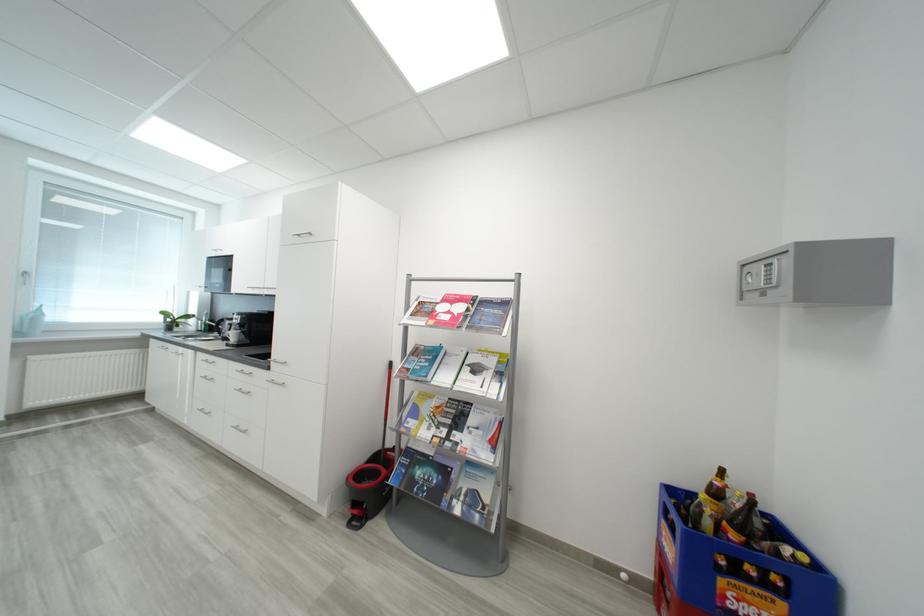
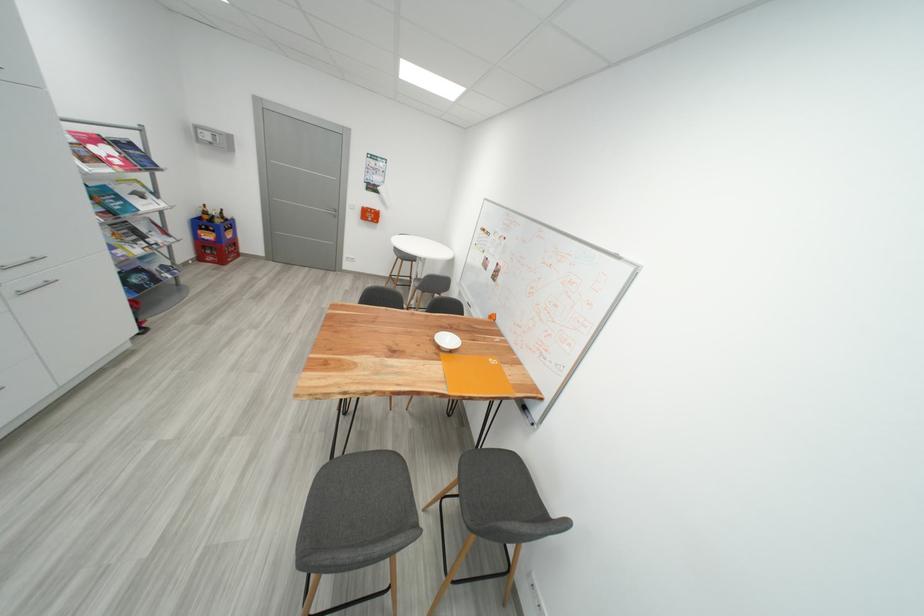
Locate, in the second image, the point that corresponds to [438,315] in the first image.

(104, 161)